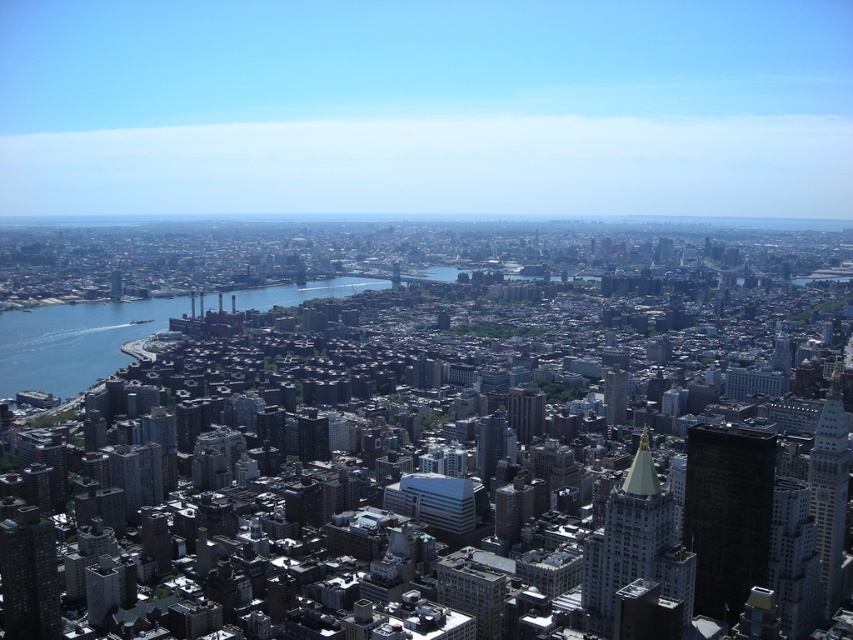
You are standing in the city and want to take a photo of the gold polished stone tower at center and the matte gray building at lower left. Which one will appear larger in your photo?

The gold polished stone tower at center will appear larger in the photo because it is closer to the viewer than the matte gray building at lower left.

You are a city planner analyzing the urban layout. Given the gold polished stone tower at center and the matte gray building at lower left, which structure would require more space for construction? Please base your answer on their sizes as depicted in the scene.

The gold polished stone tower at center is bigger than the matte gray building at lower left, so it would require more space for construction.

You are standing at the base of the matte gray building at lower left and want to see the gold polished stone tower at center. Can you see it without any obstruction?

The gold polished stone tower at center is positioned under the matte gray building at lower left, so it is likely blocked from view by the building itself.